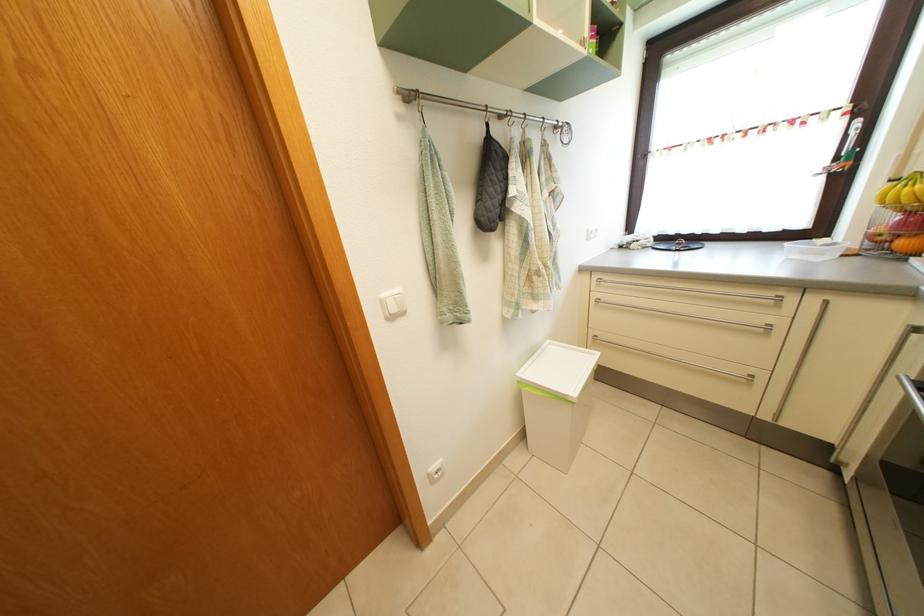
Find the location of `white light switch`. white light switch is located at coordinates (392, 304).